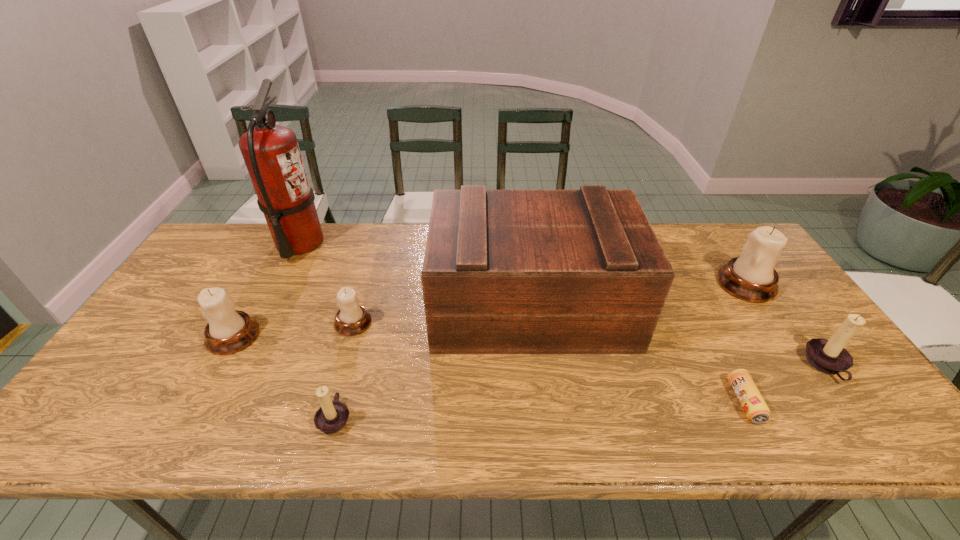
In order to click on vacant space that satisfies the following two spatial constraints: 1. toward the nozzle of the farthest white candle holder; 2. on the right side of the farthest object in this screenshot , I will do `click(278, 284)`.